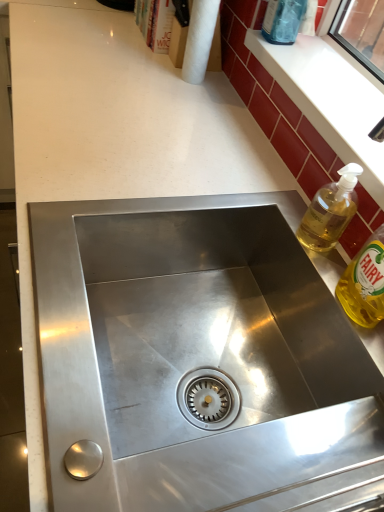
Question: In terms of width, does transparent glass bottle at upper right, the 1th bottle when ordered from top to bottom, look wider or thinner when compared to translucent yellow liquid at upper right, the second bottle when ordered from top to bottom?

Choices:
 (A) wide
 (B) thin

Answer: (B)

Question: Is transparent glass bottle at upper right, the 3th bottle in the bottom-to-top sequence, taller or shorter than translucent yellow liquid at upper right, the second bottle when ordered from top to bottom?

Choices:
 (A) tall
 (B) short

Answer: (A)

Question: Which object is positioned closest to the white paper towel at upper center?

Choices:
 (A) white glossy window sill at upper right
 (B) translucent yellow liquid at upper right, the second bottle when ordered from top to bottom
 (C) yellow translucent liquid at right, the first bottle in the bottom-to-top sequence
 (D) transparent glass bottle at upper right, the 1th bottle when ordered from top to bottom

Answer: (D)

Question: Which of these objects is positioned closest to the white glossy window sill at upper right?

Choices:
 (A) yellow translucent liquid at right, arranged as the third bottle when viewed from the top
 (B) translucent yellow liquid at upper right, which is the 2th bottle in front-to-back order
 (C) white paper towel at upper center
 (D) transparent glass bottle at upper right, the third bottle in the front-to-back sequence

Answer: (D)